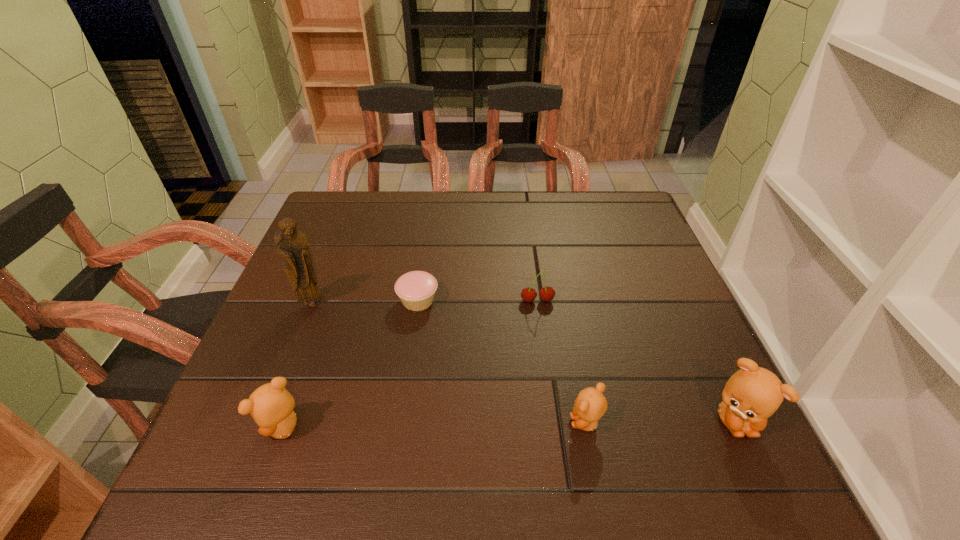
Identify the location of the second tallest teddy bear. click(x=271, y=406).

This screenshot has height=540, width=960. I want to click on the third tallest object, so click(x=271, y=406).

Where is `the shortest teddy bear`? This screenshot has height=540, width=960. the shortest teddy bear is located at coordinates (590, 405).

At what (x,y) coordinates should I click in order to perform the action: click on the second tallest object. Please return your answer as a coordinate pair (x, y). Looking at the image, I should click on (752, 394).

I want to click on the tallest teddy bear, so click(752, 394).

Where is `cherry`? This screenshot has width=960, height=540. cherry is located at coordinates (529, 294).

Where is `the tallest object`? The image size is (960, 540). the tallest object is located at coordinates (291, 243).

The image size is (960, 540). I want to click on the third object from left to right, so click(x=416, y=289).

Where is `the shortest object`? This screenshot has height=540, width=960. the shortest object is located at coordinates (416, 289).

Find the location of a particular element. This screenshot has height=540, width=960. free space located on the face of the second teddy bear from left to right is located at coordinates (416, 423).